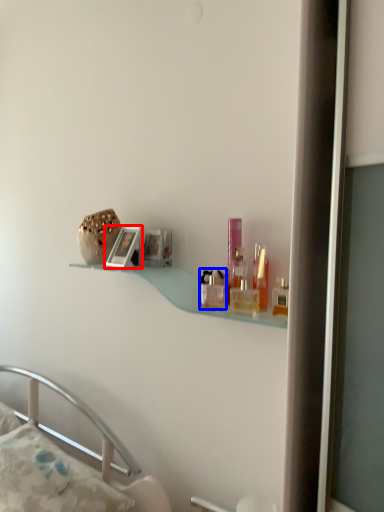
Question: Which of the following is the farthest to the observer, picture frame (highlighted by a red box) or toiletry (highlighted by a blue box)?

Choices:
 (A) picture frame
 (B) toiletry

Answer: (A)